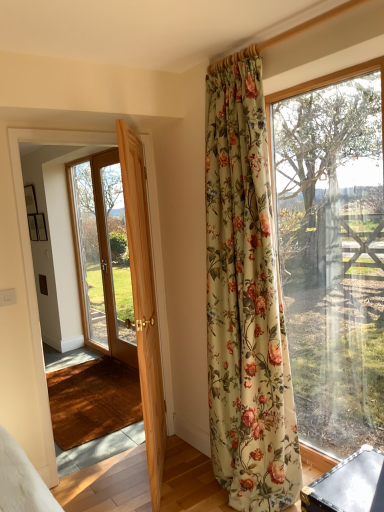
Question: Is floral fabric curtain at upper right to the left or to the right of wooden barn door at left in the image?

Choices:
 (A) left
 (B) right

Answer: (B)

Question: Based on their sizes in the image, would you say floral fabric curtain at upper right is bigger or smaller than wooden barn door at left?

Choices:
 (A) big
 (B) small

Answer: (A)

Question: Estimate the real-world distances between objects in this image. Which object is closer to the wooden barn door at left?

Choices:
 (A) transparent glass window at right
 (B) light wood door at left
 (C) floral fabric curtain at upper right
 (D) clear glass door at left

Answer: (B)

Question: Estimate the real-world distances between objects in this image. Which object is farther from the clear glass door at left?

Choices:
 (A) wooden barn door at left
 (B) floral fabric curtain at upper right
 (C) light wood door at left
 (D) transparent glass window at right

Answer: (B)